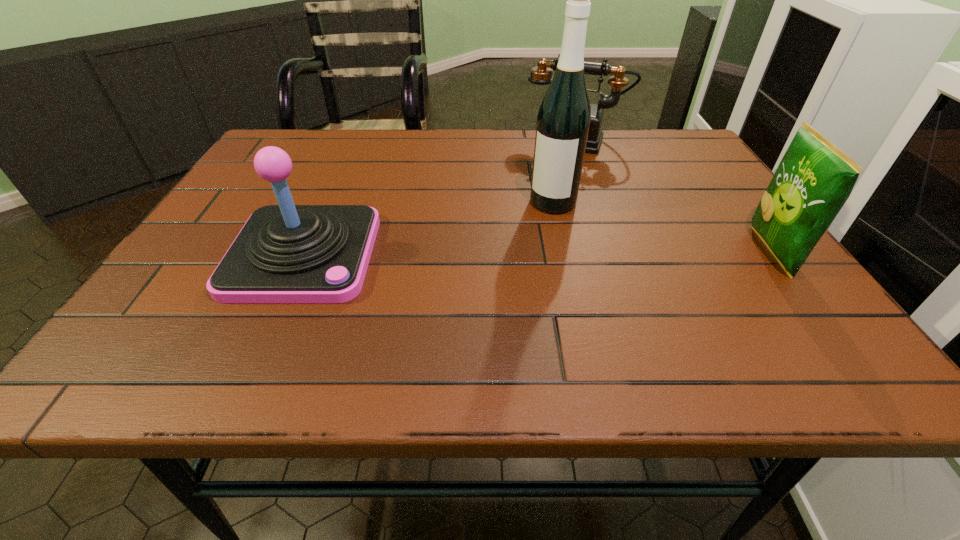
Locate an element on the screen. free point at the left edge is located at coordinates (268, 193).

In the image, there is a desktop. Find the location of `vacant space at the right edge`. vacant space at the right edge is located at coordinates (696, 181).

Where is `vacant point at the far right corner`? The image size is (960, 540). vacant point at the far right corner is located at coordinates (668, 137).

What are the coordinates of `free region at the near right corner of the desktop` in the screenshot? It's located at (797, 321).

Identify the location of free spot between the telephone and the crisp (potato chip). (673, 196).

Locate an element on the screen. vacant space that's between the farthest object and the leftmost object is located at coordinates (440, 198).

At what (x,y) coordinates should I click in order to perform the action: click on empty space that is in between the rightmost object and the farthest object. Please return your answer as a coordinate pair (x, y). This screenshot has width=960, height=540. Looking at the image, I should click on (673, 196).

Find the location of a particular element. free spot between the telephone and the rightmost object is located at coordinates (673, 196).

Locate an element on the screen. The image size is (960, 540). vacant space that is in between the leftmost object and the wine bottle is located at coordinates (428, 228).

You are a GUI agent. You are given a task and a screenshot of the screen. Output one action in this format:
    pyautogui.click(x=<x>, y=<y>)
    Task: Click on the vacant point located between the leftmost object and the crisp (potato chip)
    
    Given the screenshot: What is the action you would take?
    pyautogui.click(x=538, y=253)